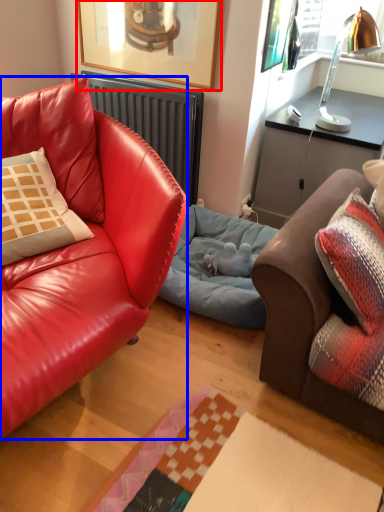
Question: Which point is closer to the camera, picture frame (highlighted by a red box) or studio couch (highlighted by a blue box)?

Choices:
 (A) picture frame
 (B) studio couch

Answer: (B)